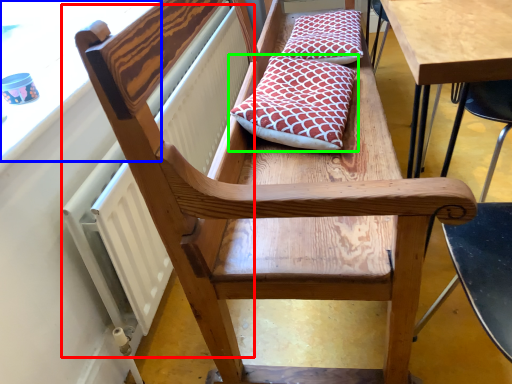
Question: Which is farther away from radiator (highlighted by a red box)? window screen (highlighted by a blue box) or pillow (highlighted by a green box)?

Choices:
 (A) window screen
 (B) pillow

Answer: (B)